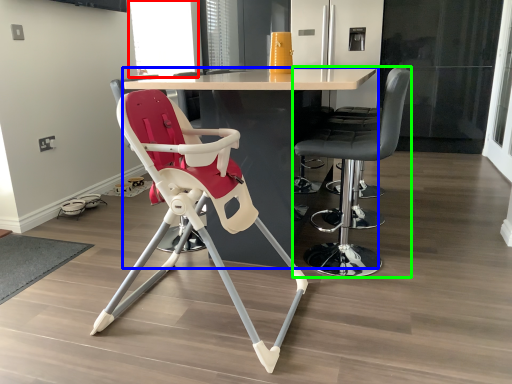
Question: Which is farther away from window screen (highlighted by a red box)? table (highlighted by a blue box) or chair (highlighted by a green box)?

Choices:
 (A) table
 (B) chair

Answer: (B)